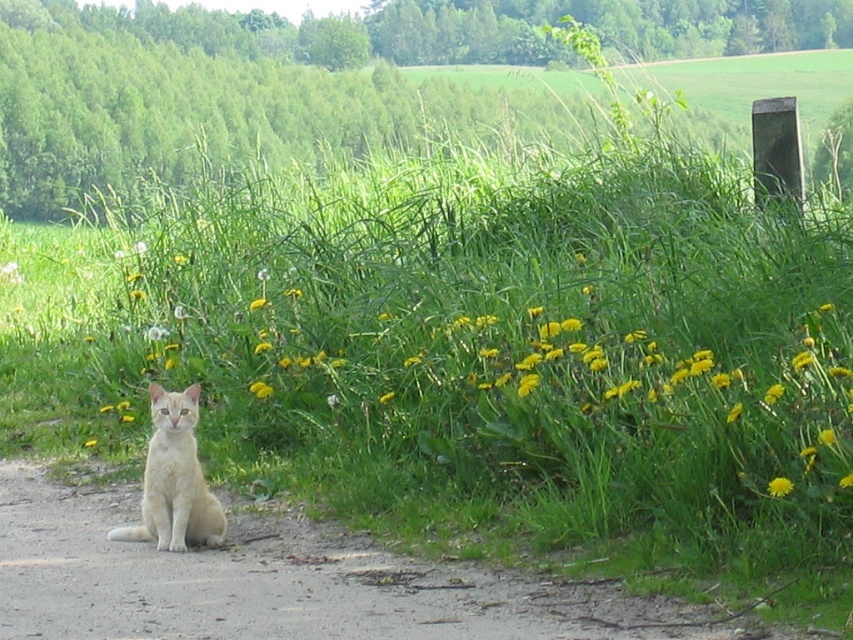
Question: Can you confirm if brown dirt track at lower left is bigger than yellow matte flower at lower right?

Choices:
 (A) yes
 (B) no

Answer: (A)

Question: Which object is closer to the camera taking this photo?

Choices:
 (A) yellow matte flower at lower right
 (B) brown dirt track at lower left

Answer: (B)

Question: Estimate the real-world distances between objects in this image. Which object is closer to the yellow matte flower at lower right?

Choices:
 (A) brown dirt track at lower left
 (B) light beige fur cat at lower left
 (C) yellow matte flower at center

Answer: (A)

Question: Is light beige fur cat at lower left positioned behind yellow matte flower at center?

Choices:
 (A) no
 (B) yes

Answer: (A)

Question: Which is nearer to the light beige fur cat at lower left?

Choices:
 (A) yellow matte flower at center
 (B) brown dirt track at lower left

Answer: (B)

Question: Is brown dirt track at lower left bigger than yellow matte flower at center?

Choices:
 (A) yes
 (B) no

Answer: (A)